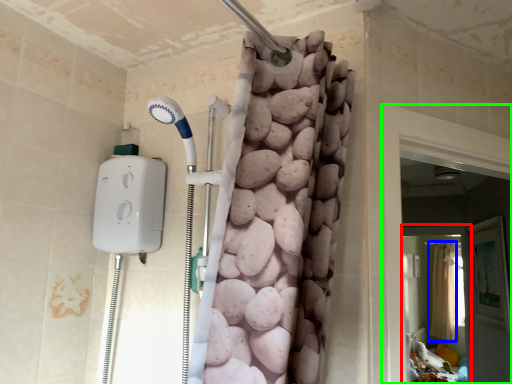
Question: Considering the real-world distances, which object is closest to screen door (highlighted by a red box)? shower curtain (highlighted by a blue box) or screen door (highlighted by a green box).

Choices:
 (A) shower curtain
 (B) screen door

Answer: (A)